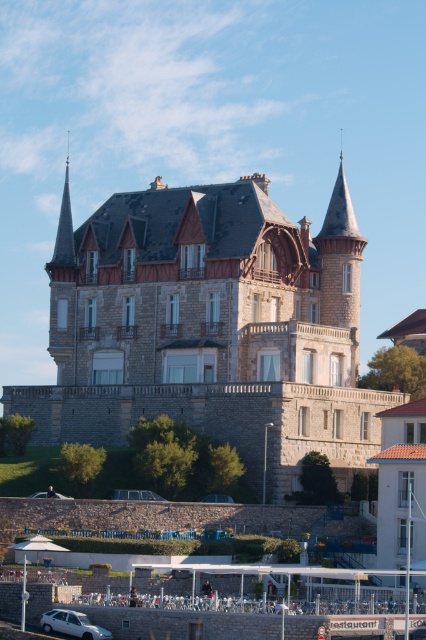
Which is behind, point (213, 356) or point (69, 630)?

Point (213, 356)

The height and width of the screenshot is (640, 426). In order to click on stone castle at center in this screenshot , I will do `click(209, 324)`.